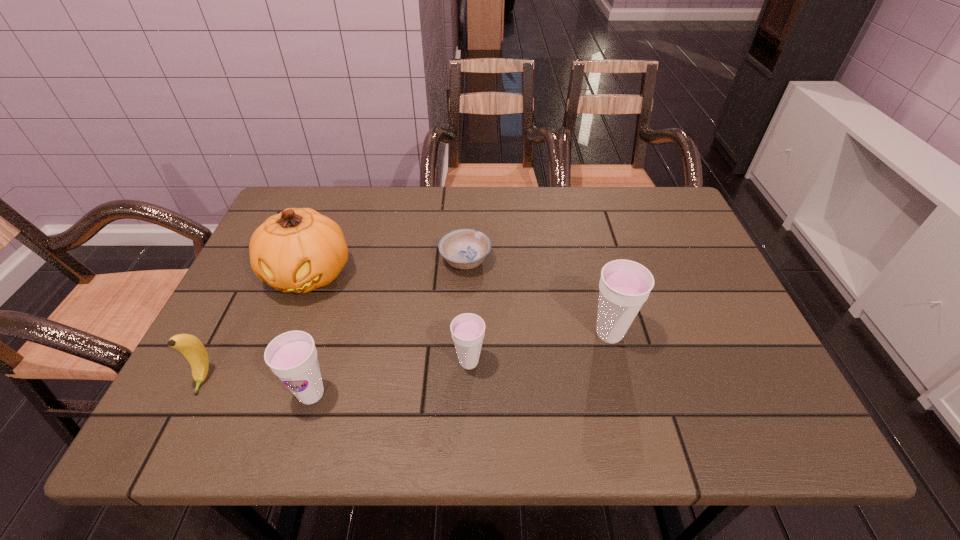
Where is `free point between the second cup from right to left and the pumpkin`? This screenshot has height=540, width=960. free point between the second cup from right to left and the pumpkin is located at coordinates (x=389, y=318).

At what (x,y) coordinates should I click in order to perform the action: click on object that stands as the third closest to the banana. Please return your answer as a coordinate pair (x, y). The image size is (960, 540). Looking at the image, I should click on (467, 330).

Locate which object is the closest to the second cup from right to left. Please provide its 2D coordinates. Your answer should be formatted as a tuple, i.e. [(x, y)], where the tuple contains the x and y coordinates of a point satisfying the conditions above.

[(465, 248)]

Where is `the closest cup to the second tallest cup`? the closest cup to the second tallest cup is located at coordinates (467, 330).

At what (x,y) coordinates should I click in order to perform the action: click on cup that stands as the closest to the tallest cup. Please return your answer as a coordinate pair (x, y). The width and height of the screenshot is (960, 540). Looking at the image, I should click on (467, 330).

Where is `free space that satisfies the following two spatial constraints: 1. on the front face of the pumpkin; 2. on the right side of the second cup from left to right`? free space that satisfies the following two spatial constraints: 1. on the front face of the pumpkin; 2. on the right side of the second cup from left to right is located at coordinates (275, 362).

Where is `vacant space that satisfies the following two spatial constraints: 1. on the front side of the rightmost cup; 2. on the left side of the shortest object`? The image size is (960, 540). vacant space that satisfies the following two spatial constraints: 1. on the front side of the rightmost cup; 2. on the left side of the shortest object is located at coordinates (463, 334).

I want to click on vacant space that satisfies the following two spatial constraints: 1. on the front face of the leftmost cup; 2. on the right side of the pumpkin, so click(x=262, y=394).

Find the location of a particular element. The height and width of the screenshot is (540, 960). free space that satisfies the following two spatial constraints: 1. on the front face of the pumpkin; 2. on the left side of the second tallest cup is located at coordinates (262, 394).